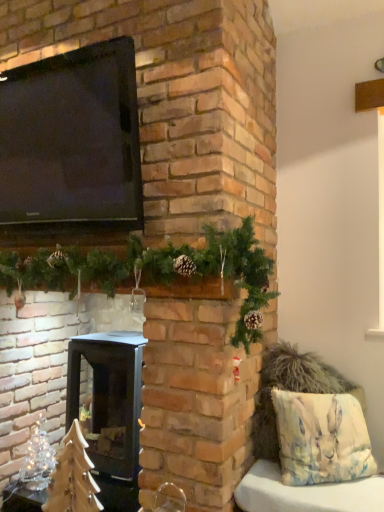
Question: Considering their positions, is black glossy tv at upper left located in front of or behind black matte wood burning stove at center?

Choices:
 (A) front
 (B) behind

Answer: (A)

Question: Is black glossy tv at upper left bigger or smaller than black matte wood burning stove at center?

Choices:
 (A) big
 (B) small

Answer: (B)

Question: Which is farther from the watercolor fabric pillow at lower right?

Choices:
 (A) black glossy tv at upper left
 (B) green pinecone garland at upper center, marked as the 1th christmas decoration in a front-to-back arrangement
 (C) clear glass christmas tree at lower left, the 2th christmas decoration positioned from the top
 (D) black matte wood burning stove at center

Answer: (C)

Question: Estimate the real-world distances between objects in this image. Which object is closer to the green pinecone garland at upper center, the 1th christmas decoration in the top-to-bottom sequence?

Choices:
 (A) black glossy tv at upper left
 (B) black matte wood burning stove at center
 (C) watercolor fabric pillow at lower right
 (D) clear glass christmas tree at lower left, the 2th christmas decoration positioned from the top

Answer: (A)